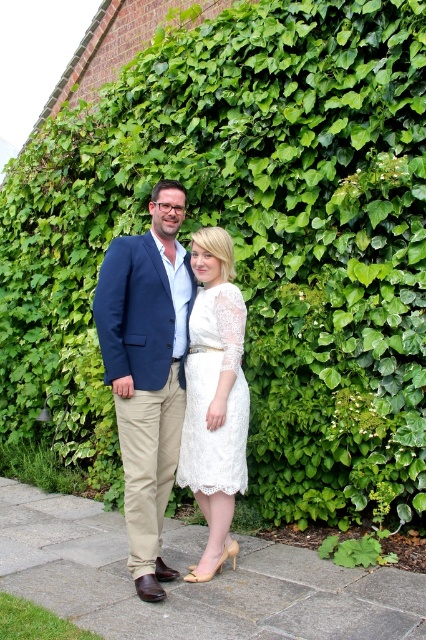
Does navy blue blazer at center appear on the right side of white lace dress at center?

In fact, navy blue blazer at center is to the left of white lace dress at center.

Is point (126, 400) behind point (198, 472)?

No.

Image resolution: width=426 pixels, height=640 pixels. Find the location of `navy blue blazer at center`. navy blue blazer at center is located at coordinates (147, 371).